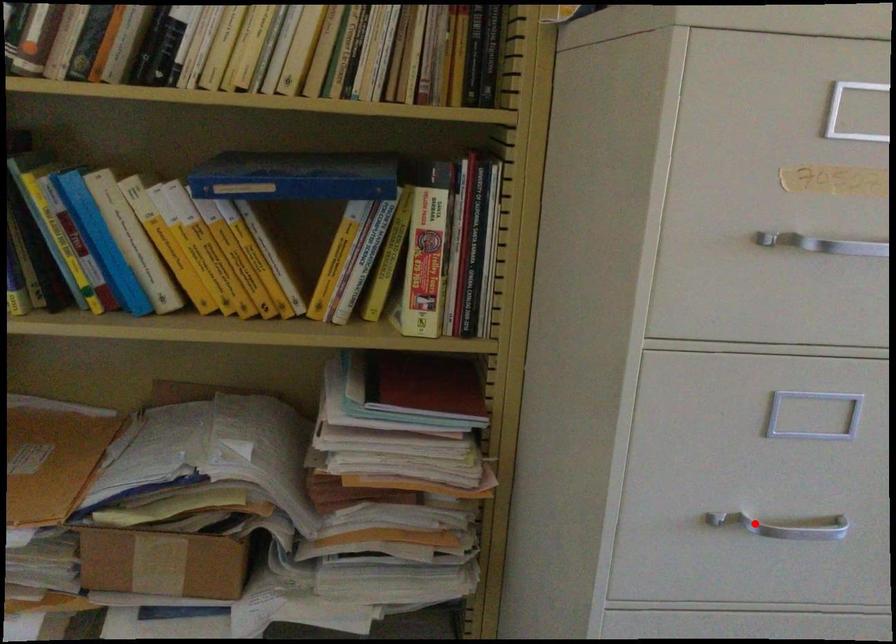
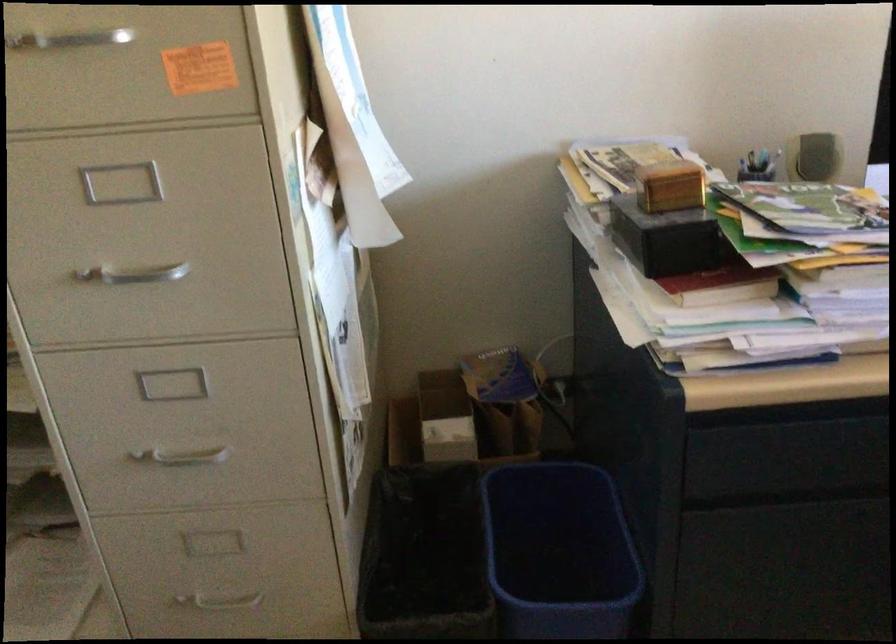
Question: I am providing you with two images of the same scene from different viewpoints. Image1 has a red point marked. In image2, the corresponding 3D location appears at what relative position? Reply with the corresponding letter.

Choices:
 (A) Closer
 (B) Farther

Answer: (B)